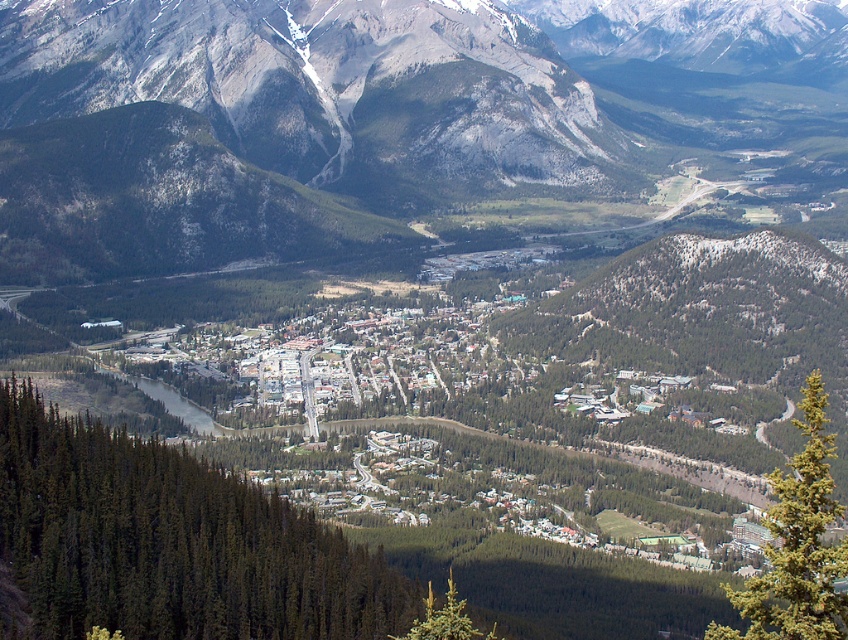
You are a hiker standing at the edge of the valley looking towards the center of the image. You see the gray rocky mountain range at center and the green matte tree at center. Which object is higher in the scene?

The gray rocky mountain range at center is located above the green matte tree at center, so it is higher in the scene.